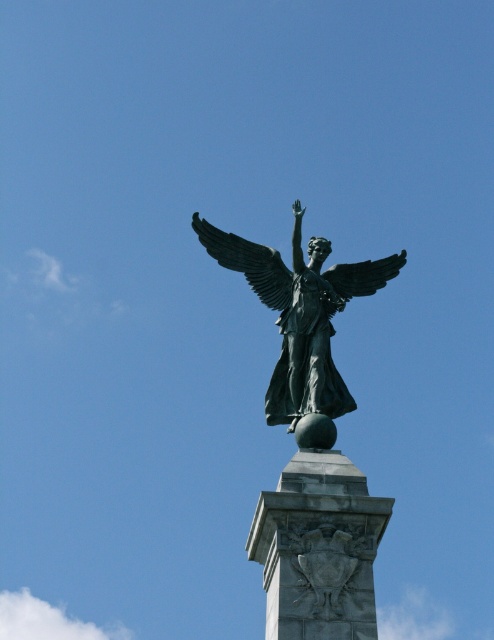
You are a photographer standing at a certain distance from the statue. You want to capture the green patina wings at upper center in your photo. What is the minimum distance you need to be from the statue to ensure the wings fill the frame?

The green patina wings at upper center is 96.62 meters from camera, so you need to be at least 96.62 meters away to ensure the wings fill the frame.

You are an art student sketching the statue. You notice the bronze statue at center and the bronze wing at upper center. Which one is closer to you from your viewpoint?

The bronze statue at center is closer to you than the bronze wing at upper center because it is positioned in front of it.

From the picture: You are standing in front of the statue and want to determine the relative positions of two points on the statue. The first point is at coordinates point (x=209, y=253), and the second is at point (x=336, y=291). Which point is closer to you?

Point (x=209, y=253) is further to the viewer than point (x=336, y=291), so the point closer to you is point (x=336, y=291).